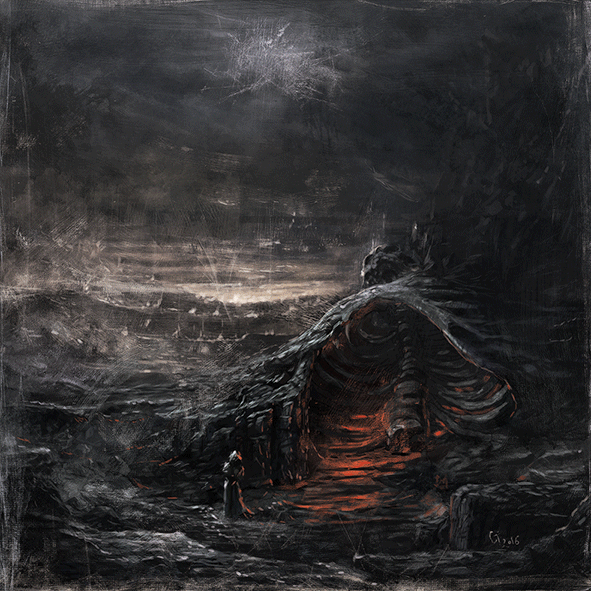
The width and height of the screenshot is (591, 591). What are the coordinates of `corner` in the screenshot? It's located at (576, 587).